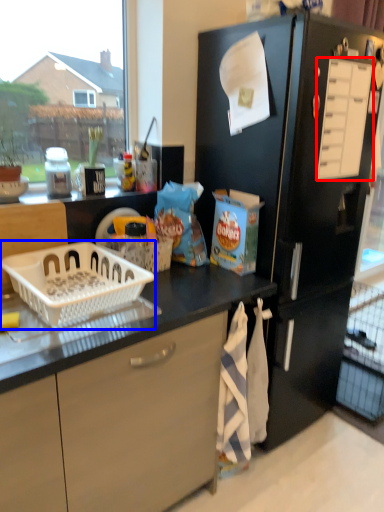
Question: Which object is closer to the camera taking this photo, drawer (highlighted by a red box) or basket (highlighted by a blue box)?

Choices:
 (A) drawer
 (B) basket

Answer: (B)